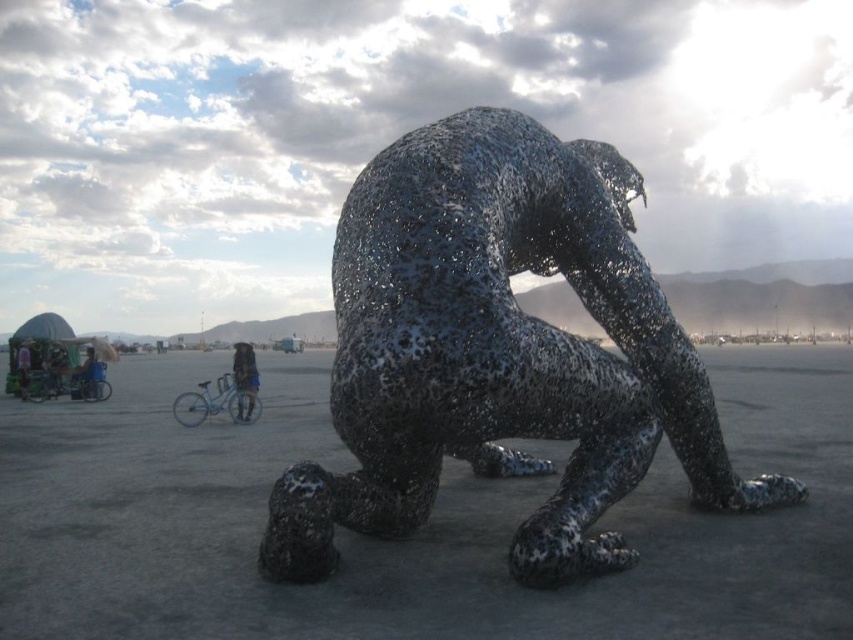
Looking at this image, you are standing at the base of the sculpture and want to place a small flag at point A and point B. The coordinates for point A are point A at (567, 262), and point B are point B at (233, 362). If you look towards the sculpture, which point is closer to you?

Point A at (567, 262) is in front of point B at (233, 362), so when looking towards the sculpture, point A at (567, 262) is closer to you.